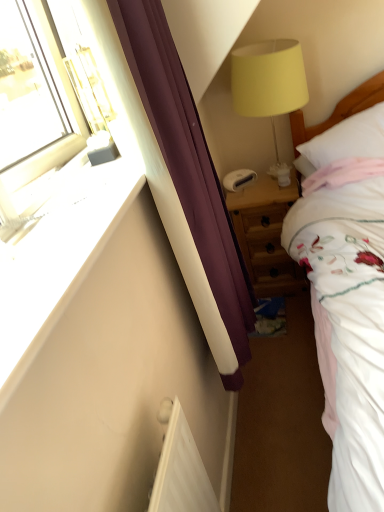
Question: Is yellow fabric lampshade at upper right facing towards white smooth wall at left?

Choices:
 (A) no
 (B) yes

Answer: (B)

Question: Is the depth of yellow fabric lampshade at upper right greater than that of white smooth wall at left?

Choices:
 (A) yes
 (B) no

Answer: (A)

Question: From a real-world perspective, is yellow fabric lampshade at upper right positioned under white smooth wall at left based on gravity?

Choices:
 (A) yes
 (B) no

Answer: (A)

Question: Can you confirm if yellow fabric lampshade at upper right is positioned to the left of white smooth wall at left?

Choices:
 (A) yes
 (B) no

Answer: (B)

Question: Does yellow fabric lampshade at upper right have a lesser height compared to white smooth wall at left?

Choices:
 (A) yes
 (B) no

Answer: (B)

Question: From the image's perspective, is yellow fabric lampshade at upper right on top of white smooth wall at left?

Choices:
 (A) yes
 (B) no

Answer: (A)

Question: Is wooden nightstand at center thinner than white soft pillow at right?

Choices:
 (A) no
 (B) yes

Answer: (B)

Question: Can we say wooden nightstand at center lies outside white soft pillow at right?

Choices:
 (A) yes
 (B) no

Answer: (A)

Question: From a real-world perspective, is wooden nightstand at center below white soft pillow at right?

Choices:
 (A) no
 (B) yes

Answer: (B)

Question: From the image's perspective, is wooden nightstand at center located above white soft pillow at right?

Choices:
 (A) no
 (B) yes

Answer: (A)

Question: Can you confirm if wooden nightstand at center is bigger than white soft pillow at right?

Choices:
 (A) no
 (B) yes

Answer: (B)

Question: Is wooden nightstand at center facing towards white soft pillow at right?

Choices:
 (A) no
 (B) yes

Answer: (A)

Question: Is the surface of white smooth wall at left in direct contact with wooden nightstand at center?

Choices:
 (A) yes
 (B) no

Answer: (B)